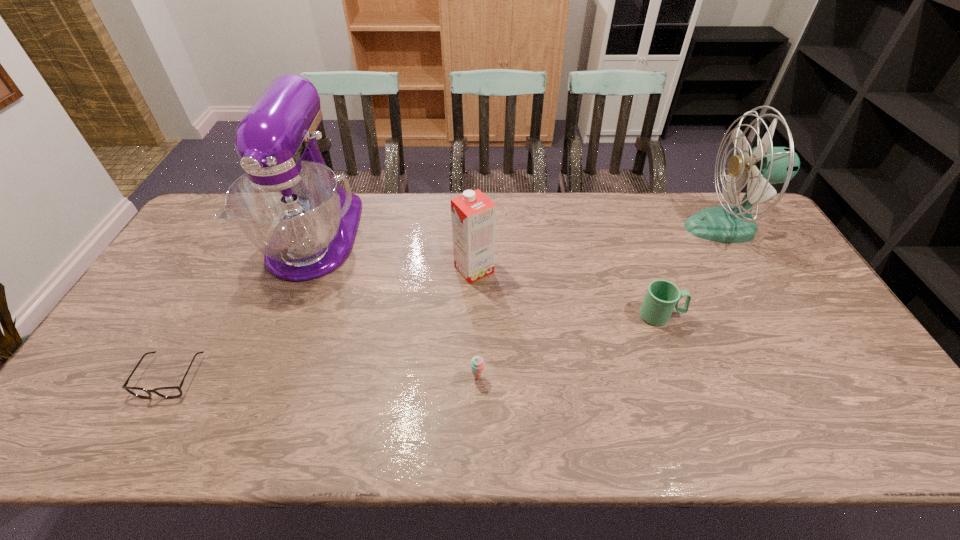
At what (x,y) coordinates should I click in order to perform the action: click on the second object from left to right. Please return your answer as a coordinate pair (x, y). The image size is (960, 540). Looking at the image, I should click on (288, 205).

Image resolution: width=960 pixels, height=540 pixels. Find the location of `fan`. fan is located at coordinates (764, 165).

The width and height of the screenshot is (960, 540). I want to click on the fourth shortest object, so click(473, 214).

Where is `the third nearest object`? The height and width of the screenshot is (540, 960). the third nearest object is located at coordinates (662, 296).

You are a GUI agent. You are given a task and a screenshot of the screen. Output one action in this format:
    pyautogui.click(x=<x>, y=<y>)
    Task: Click on the mug
    The image size is (960, 540).
    Given the screenshot: What is the action you would take?
    pyautogui.click(x=662, y=296)

I want to click on sherbert, so click(x=477, y=363).

At what (x,y) coordinates should I click in order to perform the action: click on spectacles. Please return your answer as a coordinate pair (x, y). The width and height of the screenshot is (960, 540). Looking at the image, I should click on (166, 392).

This screenshot has height=540, width=960. Find the location of `the leftmost object`. the leftmost object is located at coordinates (166, 392).

In order to click on vacant space positioned 0.170m at the bowl opening of the second object from left to right in this screenshot , I will do `click(275, 339)`.

You are a GUI agent. You are given a task and a screenshot of the screen. Output one action in this format:
    pyautogui.click(x=<x>, y=<y>)
    Task: Click on the vacant space located in front of the rightmost object, directing airflow
    The width and height of the screenshot is (960, 540).
    Given the screenshot: What is the action you would take?
    pyautogui.click(x=623, y=228)